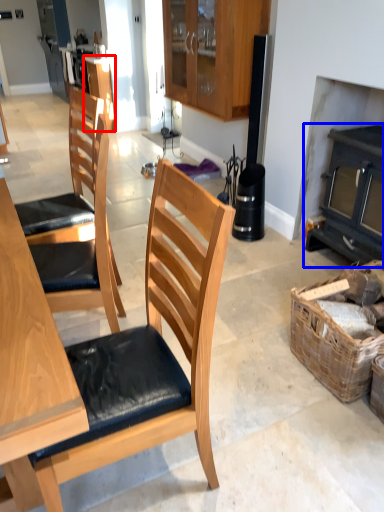
Question: Which point is further to the camera, cabinetry (highlighted by a red box) or fireplace (highlighted by a blue box)?

Choices:
 (A) cabinetry
 (B) fireplace

Answer: (A)